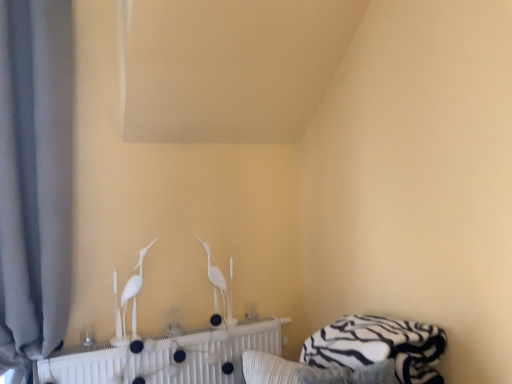
The width and height of the screenshot is (512, 384). Describe the element at coordinates (218, 285) in the screenshot. I see `white glossy bird at center, positioned as the second bird in front-to-back order` at that location.

What is the approximate height of gray fabric curtain at left?

gray fabric curtain at left is 1.81 meters in height.

Measure the distance between point (135, 297) and camera.

Point (135, 297) and camera are 2.10 meters apart from each other.

Where is `white glossy bird at center, positioned as the second bird in front-to-back order`? white glossy bird at center, positioned as the second bird in front-to-back order is located at coordinates (218, 285).

Considering the relative positions of gray fabric curtain at left and white glossy bird at center, the first bird viewed from the front, in the image provided, is gray fabric curtain at left to the right of white glossy bird at center, the first bird viewed from the front, from the viewer's perspective?

Incorrect, gray fabric curtain at left is not on the right side of white glossy bird at center, the first bird viewed from the front.

Is gray fabric curtain at left with white glossy bird at center, the first bird viewed from the front?

There is a gap between gray fabric curtain at left and white glossy bird at center, the first bird viewed from the front.

Can you confirm if gray fabric curtain at left is wider than white glossy bird at center, the first bird viewed from the front?

Indeed, gray fabric curtain at left has a greater width compared to white glossy bird at center, the first bird viewed from the front.

Can you confirm if gray fabric curtain at left is smaller than white glossy bird at center, the 2th bird viewed from the right?

Incorrect, gray fabric curtain at left is not smaller in size than white glossy bird at center, the 2th bird viewed from the right.

From a real-world perspective, is white zebra-patterned bed at lower right below gray fabric curtain at left?

Yes, from a real-world perspective, white zebra-patterned bed at lower right is below gray fabric curtain at left.

Is white zebra-patterned bed at lower right spatially inside gray fabric curtain at left, or outside of it?

white zebra-patterned bed at lower right is located beyond the bounds of gray fabric curtain at left.

Is point (375, 332) more distant than point (7, 231)?

No.

Between white glossy bird at center, the first bird when ordered from left to right, and white zebra-patterned bed at lower right, which one appears on the right side from the viewer's perspective?

From the viewer's perspective, white zebra-patterned bed at lower right appears more on the right side.

Is white glossy bird at center, the 2th bird viewed from the right, not inside white zebra-patterned bed at lower right?

Yes, white glossy bird at center, the 2th bird viewed from the right, is not within white zebra-patterned bed at lower right.

Which is nearer, (x=125, y=306) or (x=421, y=344)?

Point (x=125, y=306).

Where is `curtain above the white glossy bird at center, the first bird positioned from the back (from the image's perspective)`? curtain above the white glossy bird at center, the first bird positioned from the back (from the image's perspective) is located at coordinates (35, 180).

From the picture: From a real-world perspective, is gray fabric curtain at left located higher than white glossy bird at center, the 2th bird viewed from the left?

Yes, from a real-world perspective, gray fabric curtain at left is above white glossy bird at center, the 2th bird viewed from the left.

Between gray fabric curtain at left and white glossy bird at center, positioned as the second bird in front-to-back order, which one has smaller width?

Thinner between the two is white glossy bird at center, positioned as the second bird in front-to-back order.

Which is more distant, (17, 361) or (227, 320)?

The point (227, 320) is behind.

Considering the points (139, 257) and (53, 253), which point is behind, point (139, 257) or point (53, 253)?

The point (139, 257) is behind.

Can gray fabric curtain at left be found inside white glossy bird at center, the 2th bird viewed from the right?

No, gray fabric curtain at left is not a part of white glossy bird at center, the 2th bird viewed from the right.

From the image's perspective, relative to gray fabric curtain at left, is white glossy bird at center, the 2th bird viewed from the right, above or below?

Clearly, from the image's perspective, white glossy bird at center, the 2th bird viewed from the right, is below gray fabric curtain at left.

From a real-world perspective, which is physically above, white glossy bird at center, the 2th bird viewed from the right, or gray fabric curtain at left?

gray fabric curtain at left.

From the image's perspective, is white glossy bird at center, the first bird when ordered from left to right, below white matte radiator at center?

No, from the image's perspective, white glossy bird at center, the first bird when ordered from left to right, is not beneath white matte radiator at center.

Which of these two, white glossy bird at center, which ranks as the second bird in back-to-front order, or white matte radiator at center, is bigger?

With larger size is white matte radiator at center.

Is white zebra-patterned bed at lower right not inside white matte radiator at center?

Absolutely, white zebra-patterned bed at lower right is external to white matte radiator at center.

Which is behind, white zebra-patterned bed at lower right or white matte radiator at center?

white matte radiator at center is further from the camera.

From the image's perspective, which is above, white zebra-patterned bed at lower right or white matte radiator at center?

white zebra-patterned bed at lower right, from the image's perspective.

Locate an element on the screen. This screenshot has width=512, height=384. curtain on the left side of white glossy bird at center, the first bird viewed from the front is located at coordinates (35, 180).

This screenshot has width=512, height=384. What are the coordinates of `curtain that appears behind the white zebra-patterned bed at lower right` in the screenshot? It's located at (35, 180).

Based on their spatial positions, is white glossy bird at center, positioned as the second bird in front-to-back order, or white matte radiator at center closer to white glossy bird at center, the 2th bird viewed from the right?

white matte radiator at center is positioned closer to the anchor white glossy bird at center, the 2th bird viewed from the right.

Based on their spatial positions, is gray fabric curtain at left or white glossy bird at center, positioned as the second bird in front-to-back order, further from white matte radiator at center?

Among the two, gray fabric curtain at left is located further to white matte radiator at center.

Looking at the image, which one is located further to white glossy bird at center, the 2th bird viewed from the right, white glossy bird at center, the 2th bird viewed from the left, or gray fabric curtain at left?

The object further to white glossy bird at center, the 2th bird viewed from the right, is gray fabric curtain at left.

Looking at the image, which one is located closer to white matte radiator at center, gray fabric curtain at left or white zebra-patterned bed at lower right?

Based on the image, gray fabric curtain at left appears to be nearer to white matte radiator at center.

When comparing their distances from white glossy bird at center, the 2th bird viewed from the right, does gray fabric curtain at left or white zebra-patterned bed at lower right seem closer?

The object closer to white glossy bird at center, the 2th bird viewed from the right, is gray fabric curtain at left.

Consider the image. Considering their positions, is white glossy bird at center, positioned as the second bird in front-to-back order, positioned further to white glossy bird at center, the 2th bird viewed from the right, than white zebra-patterned bed at lower right?

white zebra-patterned bed at lower right is further to white glossy bird at center, the 2th bird viewed from the right.

Based on their spatial positions, is white glossy bird at center, the first bird when ordered from left to right, or white glossy bird at center, positioned as the second bird in front-to-back order, closer to gray fabric curtain at left?

white glossy bird at center, the first bird when ordered from left to right, is positioned closer to the anchor gray fabric curtain at left.

Based on their spatial positions, is white glossy bird at center, the first bird positioned from the back, or white glossy bird at center, the first bird when ordered from left to right, closer to white matte radiator at center?

white glossy bird at center, the first bird when ordered from left to right.

Image resolution: width=512 pixels, height=384 pixels. Identify the location of bird that lies between white glossy bird at center, the 2th bird viewed from the left, and white matte radiator at center from top to bottom. (134, 292).

Where is `radiator between white zebra-patterned bed at lower right and white glossy bird at center, the first bird when ordered from left to right, in the front-back direction`? This screenshot has width=512, height=384. radiator between white zebra-patterned bed at lower right and white glossy bird at center, the first bird when ordered from left to right, in the front-back direction is located at coordinates (165, 358).

Find the location of `radiator positioned between white zebra-patterned bed at lower right and white glossy bird at center, the 2th bird viewed from the left, from near to far`. radiator positioned between white zebra-patterned bed at lower right and white glossy bird at center, the 2th bird viewed from the left, from near to far is located at coordinates (165, 358).

Image resolution: width=512 pixels, height=384 pixels. In order to click on bird located between white zebra-patterned bed at lower right and white glossy bird at center, arranged as the 1th bird when viewed from the right, in the depth direction in this screenshot , I will do `click(134, 292)`.